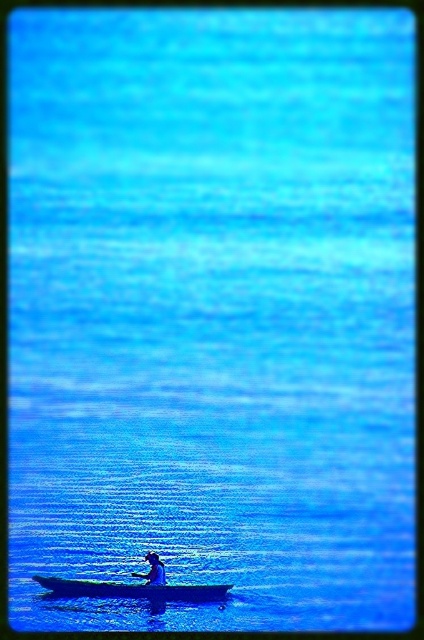
Is dark blue wood canoe at center further to the viewer compared to blue matte person at center?

Yes, it is behind blue matte person at center.

Between dark blue wood canoe at center and blue matte person at center, which one is positioned lower?

dark blue wood canoe at center

In order to click on dark blue wood canoe at center in this screenshot , I will do `click(133, 589)`.